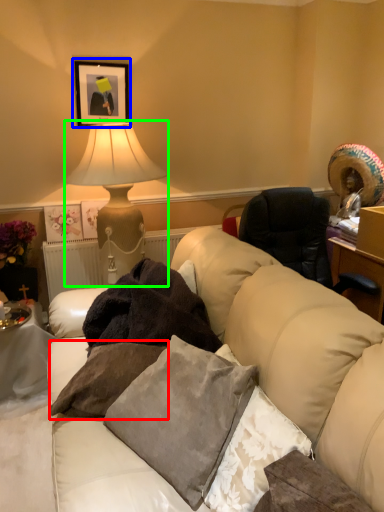
Question: Considering the real-world distances, which object is farthest from pillow (highlighted by a red box)? picture frame (highlighted by a blue box) or lamp (highlighted by a green box)?

Choices:
 (A) picture frame
 (B) lamp

Answer: (A)